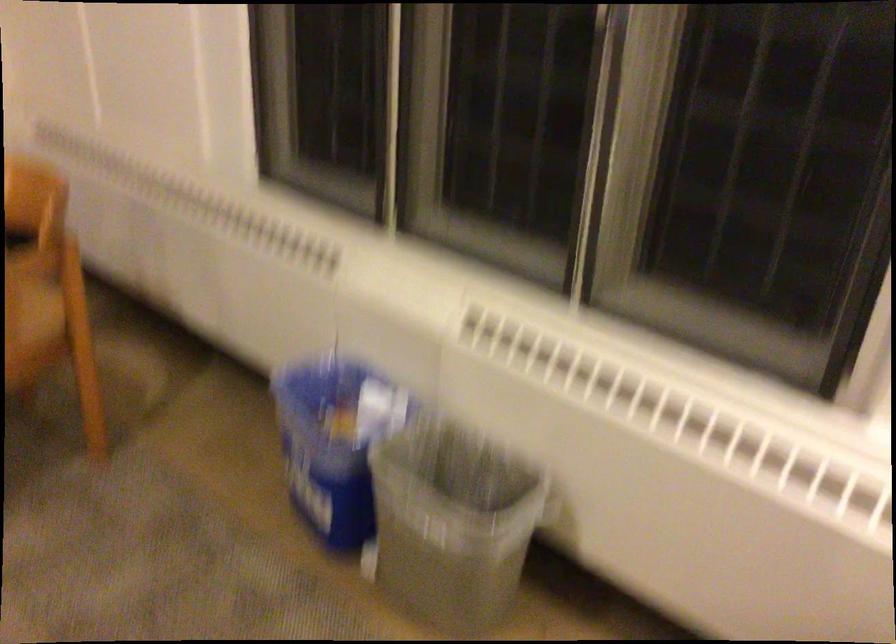
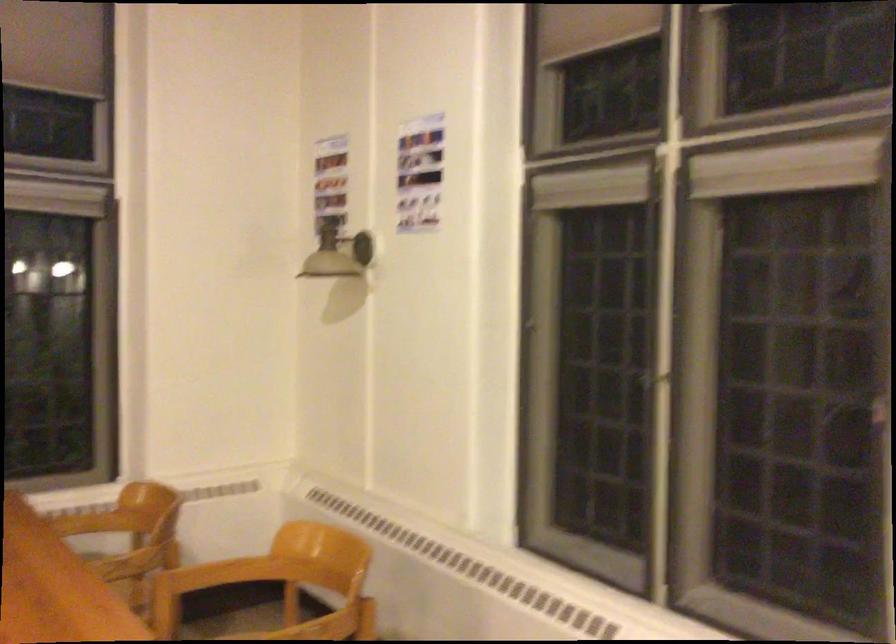
In a continuous first-person perspective shot, in which direction is the camera moving?

The movement direction of the cameraman is left, backward.